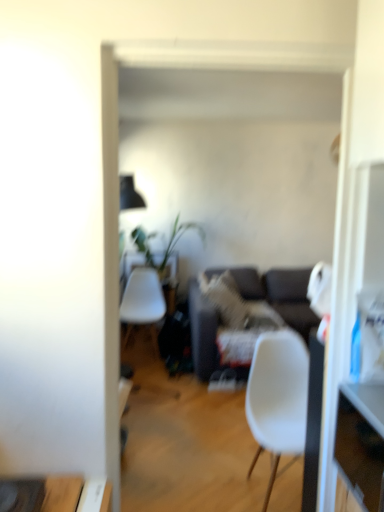
What do you see at coordinates (280, 294) in the screenshot? Image resolution: width=384 pixels, height=512 pixels. I see `dark gray fabric couch at center` at bounding box center [280, 294].

The height and width of the screenshot is (512, 384). What do you see at coordinates (278, 397) in the screenshot? I see `white matte chair at center` at bounding box center [278, 397].

Measure the distance between white matte chair at center and camera.

white matte chair at center and camera are 6.37 feet apart from each other.

The height and width of the screenshot is (512, 384). What do you see at coordinates (170, 281) in the screenshot?
I see `white plastic desk at center` at bounding box center [170, 281].

What do you see at coordinates (166, 246) in the screenshot?
I see `green leafy plant at center` at bounding box center [166, 246].

Locate an element on the screen. Image resolution: width=384 pixels, height=512 pixels. dark gray fabric couch at center is located at coordinates (280, 294).

Is dark gray fabric couch at center thinner than white plastic desk at center?

No, dark gray fabric couch at center is not thinner than white plastic desk at center.

Can white plastic desk at center be found inside dark gray fabric couch at center?

No, white plastic desk at center is not surrounded by dark gray fabric couch at center.

Is dark gray fabric couch at center not near white plastic desk at center?

No, dark gray fabric couch at center is not far away from white plastic desk at center.

Where is `studio couch that is below the white plastic desk at center (from the image's perspective)`? studio couch that is below the white plastic desk at center (from the image's perspective) is located at coordinates (280, 294).

Considering the positions of objects white matte chair at center and white plastic desk at center in the image provided, who is more to the left, white matte chair at center or white plastic desk at center?

white plastic desk at center is more to the left.

Is white matte chair at center positioned with its back to white plastic desk at center?

Yes, white matte chair at center is positioned with its back facing white plastic desk at center.

Identify the location of chair directly beneath the white plastic desk at center (from a real-world perspective). (278, 397).

The height and width of the screenshot is (512, 384). Find the location of `houseplant in front of the white plastic desk at center`. houseplant in front of the white plastic desk at center is located at coordinates (166, 246).

Considering the relative positions of green leafy plant at center and white plastic desk at center in the image provided, is green leafy plant at center to the left or to the right of white plastic desk at center?

green leafy plant at center is positioned on white plastic desk at center's right side.

Is point (168, 249) closer or farther from the camera than point (170, 301)?

Point (168, 249) is positioned farther from the camera compared to point (170, 301).

Could you tell me if green leafy plant at center is facing dark gray fabric couch at center?

No.

From the image's perspective, between green leafy plant at center and dark gray fabric couch at center, which one is located above?

green leafy plant at center is shown above in the image.

Looking at their sizes, would you say green leafy plant at center is wider or thinner than dark gray fabric couch at center?

green leafy plant at center is thinner than dark gray fabric couch at center.

Can you tell me how much green leafy plant at center and dark gray fabric couch at center differ in facing direction?

They differ by 90 degrees in their facing directions.

Consider the image. Considering their positions, is white plastic desk at center located in front of or behind white matte chair at center?

Visually, white plastic desk at center is located behind white matte chair at center.

Is white plastic desk at center touching white matte chair at center?

No.

Find the location of a particular element. This screenshot has height=512, width=384. chair below the white plastic desk at center (from a real-world perspective) is located at coordinates (278, 397).

Is white plastic desk at center outside of white matte chair at center?

white plastic desk at center is positioned outside white matte chair at center.

Locate an element on the screen. Image resolution: width=384 pixels, height=512 pixels. houseplant in front of the white plastic desk at center is located at coordinates (166, 246).

Consider the image. Is green leafy plant at center at the back of white plastic desk at center?

white plastic desk at center is not turned away from green leafy plant at center.

Do you think white plastic desk at center is within green leafy plant at center, or outside of it?

white plastic desk at center cannot be found inside green leafy plant at center.

Between white plastic desk at center and green leafy plant at center, which one has less height?

green leafy plant at center is shorter.

From the image's perspective, is white plastic desk at center located above wooden drawer at right?

Yes, from the image's perspective, white plastic desk at center is above wooden drawer at right.

Is white plastic desk at center wider or thinner than wooden drawer at right?

Considering their sizes, white plastic desk at center looks slimmer than wooden drawer at right.

You are a GUI agent. You are given a task and a screenshot of the screen. Output one action in this format:
    pyautogui.click(x=<x>, y=<y>)
    Task: Click on the desk that is on the left side of wooden drawer at right
    The width and height of the screenshot is (384, 512).
    Given the screenshot: What is the action you would take?
    pyautogui.click(x=170, y=281)

Is white plastic desk at center to the right of wooden drawer at right from the viewer's perspective?

Incorrect, white plastic desk at center is not on the right side of wooden drawer at right.

This screenshot has width=384, height=512. I want to click on desk above the dark gray fabric couch at center (from a real-world perspective), so (170, 281).

Locate an element on the screen. chair located underneath the white plastic desk at center (from a real-world perspective) is located at coordinates (278, 397).

From the picture: Considering their positions, is wooden drawer at right positioned closer to white matte chair at center than green leafy plant at center?

wooden drawer at right.

Which object lies nearer to the anchor point green leafy plant at center, white plastic desk at center or dark gray fabric couch at center?

Based on the image, white plastic desk at center appears to be nearer to green leafy plant at center.

From the image, which object appears to be nearer to wooden drawer at right, dark gray fabric couch at center or white matte chair at center?

Based on the image, white matte chair at center appears to be nearer to wooden drawer at right.

Estimate the real-world distances between objects in this image. Which object is closer to white plastic desk at center, green leafy plant at center or dark gray fabric couch at center?

green leafy plant at center.

From the image, which object appears to be farther from white matte chair at center, wooden drawer at right or dark gray fabric couch at center?

Based on the image, dark gray fabric couch at center appears to be further to white matte chair at center.

Which object lies further to the anchor point white matte chair at center, white plastic desk at center or wooden drawer at right?

white plastic desk at center lies further to white matte chair at center than the other object.

Looking at this image, looking at the image, which one is located further to dark gray fabric couch at center, green leafy plant at center or wooden drawer at right?

Based on the image, wooden drawer at right appears to be further to dark gray fabric couch at center.

Estimate the real-world distances between objects in this image. Which object is further from wooden drawer at right, green leafy plant at center or dark gray fabric couch at center?

green leafy plant at center is positioned further to the anchor wooden drawer at right.

Where is `chair located between wooden drawer at right and white plastic desk at center in the depth direction`? chair located between wooden drawer at right and white plastic desk at center in the depth direction is located at coordinates (278, 397).

What are the coordinates of `studio couch positioned between white matte chair at center and green leafy plant at center from near to far` in the screenshot? It's located at (280, 294).

Locate an element on the screen. houseplant between white matte chair at center and white plastic desk at center in the front-back direction is located at coordinates (166, 246).

The image size is (384, 512). Identify the location of chair between wooden drawer at right and dark gray fabric couch at center along the z-axis. (278, 397).